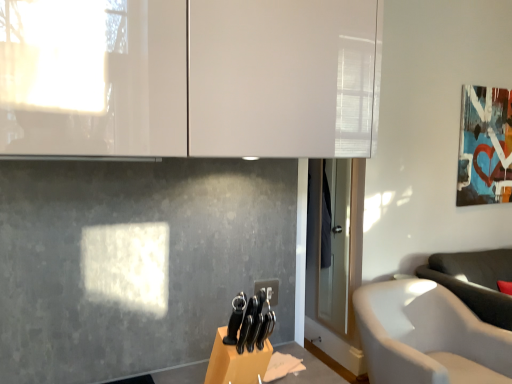
Question: Based on their positions, is white glossy cabinet at upper center located to the left or right of matte acrylic picture frame at upper right?

Choices:
 (A) right
 (B) left

Answer: (B)

Question: Is white glossy cabinet at upper center inside the boundaries of matte acrylic picture frame at upper right, or outside?

Choices:
 (A) outside
 (B) inside

Answer: (A)

Question: Which of these objects is positioned closest to the matte acrylic picture frame at upper right?

Choices:
 (A) white fabric chair at lower right
 (B) white glossy cabinet at upper center

Answer: (A)

Question: Based on their relative distances, which object is farther from the white glossy cabinet at upper center?

Choices:
 (A) white fabric chair at lower right
 (B) matte acrylic picture frame at upper right

Answer: (B)